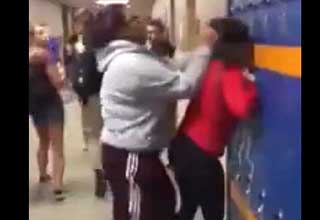
Find the location of a particular element. Image resolution: width=320 pixels, height=220 pixels. floor is located at coordinates (77, 206).